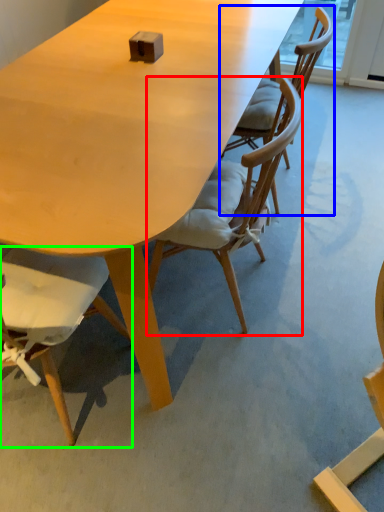
Question: Based on their relative distances, which object is farther from chair (highlighted by a red box)? Choose from chair (highlighted by a blue box) and chair (highlighted by a green box).

Choices:
 (A) chair
 (B) chair

Answer: (B)